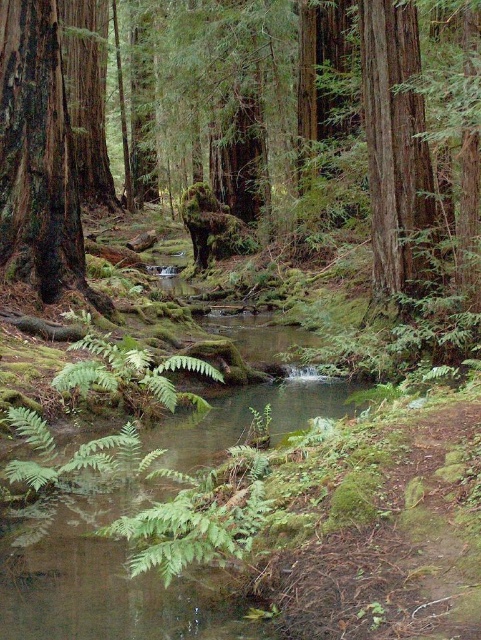
Question: Among these objects, which one is farthest from the camera?

Choices:
 (A) smooth dark brown tree trunk at left
 (B) smooth reddish-brown tree trunk at upper right

Answer: (B)

Question: Does smooth dark brown tree trunk at left have a smaller size compared to smooth reddish-brown tree trunk at upper right?

Choices:
 (A) yes
 (B) no

Answer: (B)

Question: Is smooth dark brown tree trunk at left in front of smooth reddish-brown tree trunk at upper right?

Choices:
 (A) yes
 (B) no

Answer: (A)

Question: Which of the following is the farthest from the observer?

Choices:
 (A) smooth reddish-brown tree trunk at upper right
 (B) smooth dark brown tree trunk at left

Answer: (A)

Question: Which object is farther from the camera taking this photo?

Choices:
 (A) smooth reddish-brown tree trunk at upper right
 (B) smooth dark brown tree trunk at left

Answer: (A)

Question: Does smooth dark brown tree trunk at left appear over smooth reddish-brown tree trunk at upper right?

Choices:
 (A) no
 (B) yes

Answer: (A)